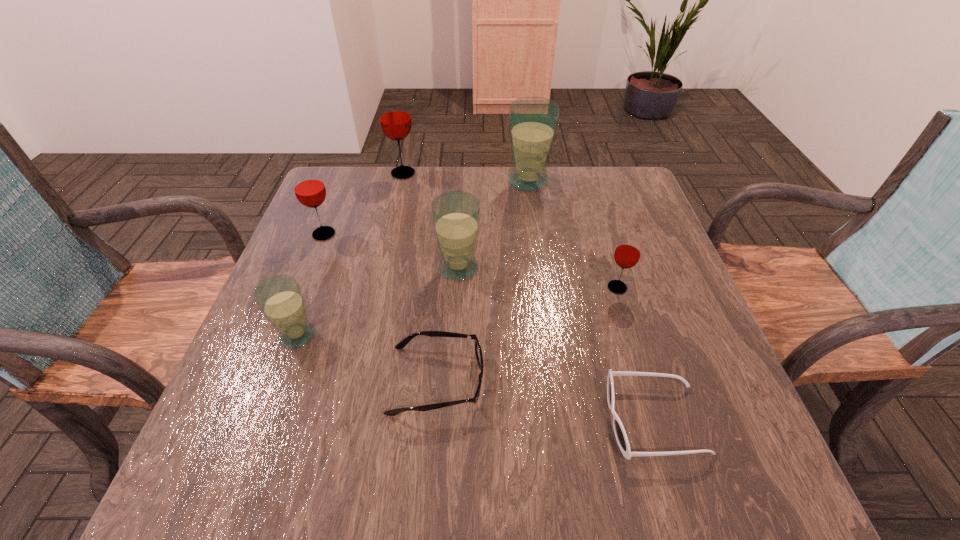
Identify the location of the third object from left to right. (395, 119).

I want to click on the farthest red glass, so click(395, 119).

Locate an element on the screen. This screenshot has width=960, height=540. the rightmost blue glass is located at coordinates (533, 121).

Find the location of a particular element. This screenshot has height=540, width=960. the fifth glass from left to right is located at coordinates (533, 121).

The image size is (960, 540). Find the location of `the second biggest red glass`. the second biggest red glass is located at coordinates (309, 188).

Identify the location of the third farthest glass. (309, 188).

The width and height of the screenshot is (960, 540). What are the coordinates of `the second blue glass from left to right` in the screenshot? It's located at (455, 215).

Image resolution: width=960 pixels, height=540 pixels. I want to click on the third glass from right to left, so coord(455,215).

You are a GUI agent. You are given a task and a screenshot of the screen. Output one action in this format:
    pyautogui.click(x=<x>, y=<y>)
    Task: Click on the nearest red glass
    This screenshot has height=540, width=960.
    Given the screenshot: What is the action you would take?
    pyautogui.click(x=627, y=253)

This screenshot has height=540, width=960. Identify the location of the rightmost red glass. (627, 253).